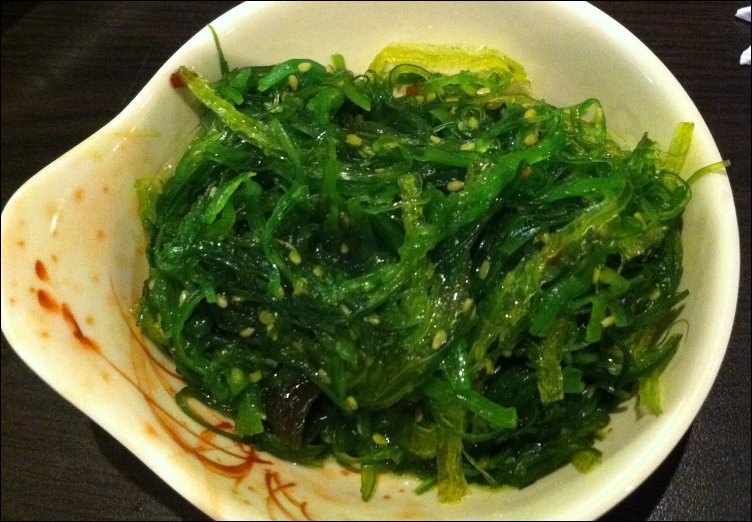
I want to click on heavy white china bowl, so click(x=711, y=294).